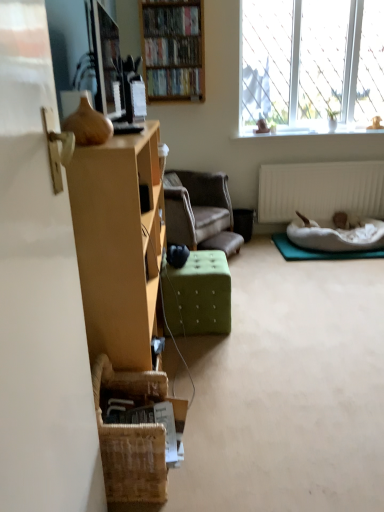
Question: From the image's perspective, is white fluffy cat at lower right above wooden bookshelf at upper center, the first book viewed from the top?

Choices:
 (A) yes
 (B) no

Answer: (B)

Question: Can we say white fluffy cat at lower right lies outside wooden bookshelf at upper center, which is counted as the third book, starting from the bottom?

Choices:
 (A) yes
 (B) no

Answer: (A)

Question: Is the position of white fluffy cat at lower right more distant than that of wooden bookshelf at upper center, which is counted as the third book, starting from the bottom?

Choices:
 (A) no
 (B) yes

Answer: (B)

Question: Can you confirm if white fluffy cat at lower right is bigger than wooden bookshelf at upper center, the first book viewed from the top?

Choices:
 (A) no
 (B) yes

Answer: (A)

Question: Is wooden bookshelf at upper center, which is counted as the third book, starting from the bottom, a part of white fluffy cat at lower right?

Choices:
 (A) yes
 (B) no

Answer: (B)

Question: Would you consider white fluffy cat at lower right to be distant from wooden bookshelf at upper center, the first book viewed from the top?

Choices:
 (A) no
 (B) yes

Answer: (B)

Question: From the image's perspective, is velvet brown armchair at center beneath white textured radiator at lower right?

Choices:
 (A) yes
 (B) no

Answer: (A)

Question: Does velvet brown armchair at center lie in front of white textured radiator at lower right?

Choices:
 (A) yes
 (B) no

Answer: (A)

Question: Can you confirm if velvet brown armchair at center is bigger than white textured radiator at lower right?

Choices:
 (A) no
 (B) yes

Answer: (B)

Question: From a real-world perspective, is velvet brown armchair at center located beneath white textured radiator at lower right?

Choices:
 (A) no
 (B) yes

Answer: (B)

Question: Does velvet brown armchair at center have a greater width compared to white textured radiator at lower right?

Choices:
 (A) yes
 (B) no

Answer: (A)

Question: Considering the relative sizes of velvet brown armchair at center and white textured radiator at lower right in the image provided, is velvet brown armchair at center taller than white textured radiator at lower right?

Choices:
 (A) yes
 (B) no

Answer: (A)

Question: From the image's perspective, is white fluffy cat at lower right beneath white textured radiator at lower right?

Choices:
 (A) no
 (B) yes

Answer: (B)